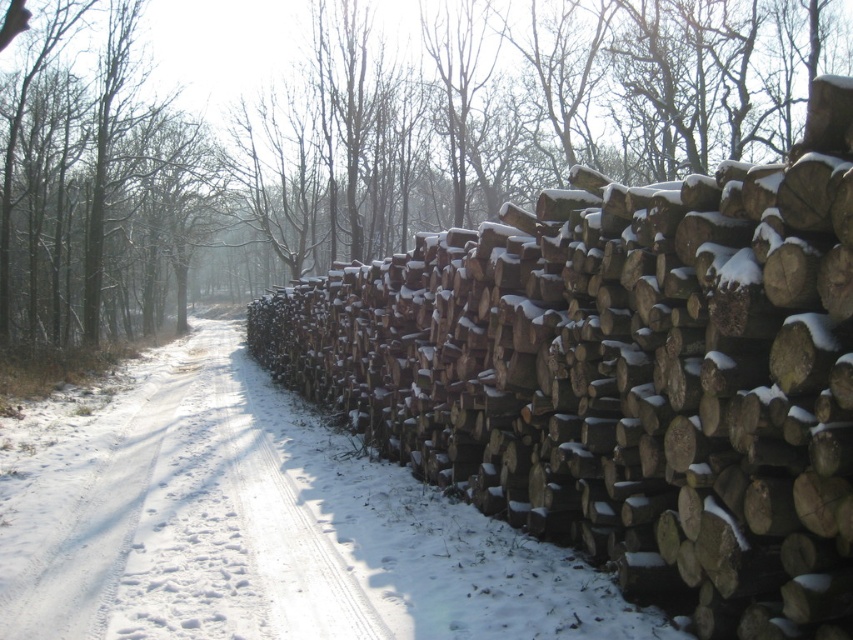
Is brown rough wood at right wider than smooth brown tree trunk at left?

Indeed, brown rough wood at right has a greater width compared to smooth brown tree trunk at left.

Does point (360, 186) come behind point (132, 92)?

Yes, it is behind point (132, 92).

Locate an element on the screen. The width and height of the screenshot is (853, 640). brown rough wood at right is located at coordinates (364, 140).

Can you confirm if brown rough wood at right is thinner than white powdery snow at right?

No, brown rough wood at right is not thinner than white powdery snow at right.

Between point (738, 42) and point (366, 477), which one is positioned behind?

The point (738, 42) is behind.

The image size is (853, 640). Describe the element at coordinates (364, 140) in the screenshot. I see `brown rough wood at right` at that location.

Identify the location of brown rough wood at right. This screenshot has height=640, width=853. (364, 140).

Consider the image. Can you confirm if snow-covered wood at right is positioned below white powdery snow at right?

Actually, snow-covered wood at right is above white powdery snow at right.

Between snow-covered wood at right and white powdery snow at right, which one appears on the right side from the viewer's perspective?

Positioned to the right is snow-covered wood at right.

Which is in front, point (721, 317) or point (213, 536)?

Point (721, 317)

Find the location of a particular element. Image resolution: width=853 pixels, height=640 pixels. snow-covered wood at right is located at coordinates (625, 374).